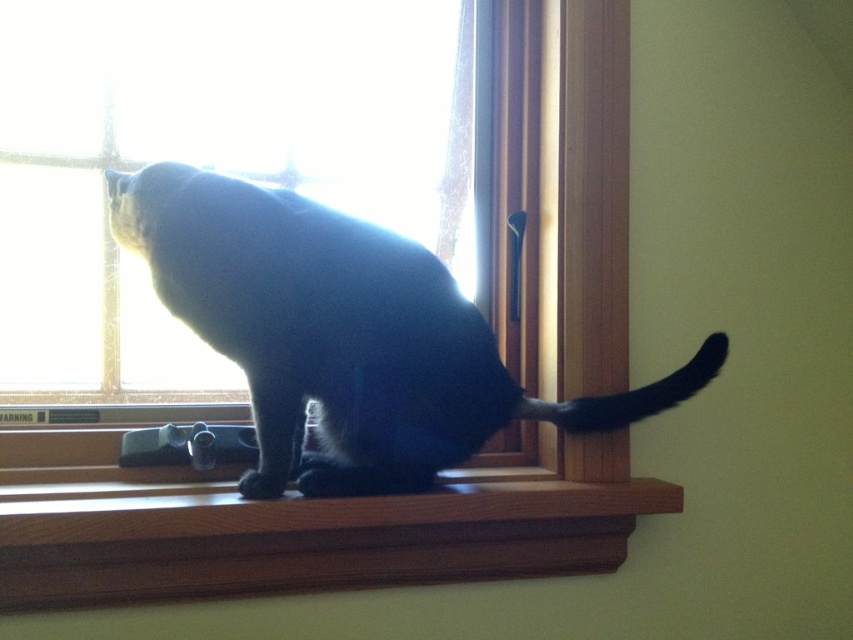
Question: Considering the real-world distances, which object is farthest from the wooden at center?

Choices:
 (A) black fur cat at center
 (B) clear glass window at upper left

Answer: (B)

Question: Which object is the farthest from the wooden at center?

Choices:
 (A) clear glass window at upper left
 (B) black fur cat at center

Answer: (A)

Question: Does clear glass window at upper left have a lesser width compared to black fur cat at center?

Choices:
 (A) no
 (B) yes

Answer: (B)

Question: Which of the following is the closest to the observer?

Choices:
 (A) (64, 148)
 (B) (398, 577)

Answer: (B)

Question: In this image, where is black fur cat at center located relative to wooden at center?

Choices:
 (A) below
 (B) above

Answer: (B)

Question: Can you confirm if black fur cat at center is wider than wooden at center?

Choices:
 (A) yes
 (B) no

Answer: (B)